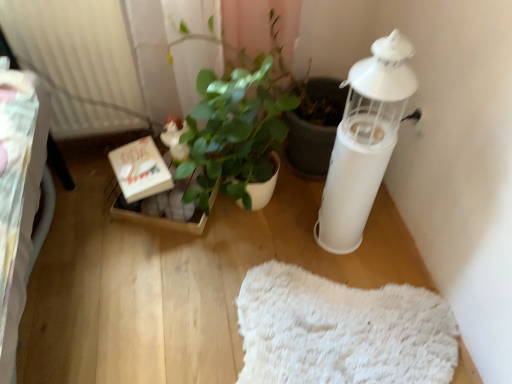
Question: Is white fluffy mat at lower center not near white matte candle holder at right?

Choices:
 (A) yes
 (B) no

Answer: (B)

Question: Could you tell me if white fluffy mat at lower center is turned towards white matte candle holder at right?

Choices:
 (A) yes
 (B) no

Answer: (B)

Question: Is white fluffy mat at lower center positioned beyond the bounds of white matte candle holder at right?

Choices:
 (A) no
 (B) yes

Answer: (B)

Question: Is white fluffy mat at lower center further to camera compared to white matte candle holder at right?

Choices:
 (A) no
 (B) yes

Answer: (B)

Question: Considering the relative sizes of white fluffy mat at lower center and white matte candle holder at right in the image provided, is white fluffy mat at lower center wider than white matte candle holder at right?

Choices:
 (A) no
 (B) yes

Answer: (B)

Question: From the image's perspective, is white ribbed radiator at upper left positioned above or below wooden cardboard box at center, marked as the second cardboard box in a front-to-back arrangement?

Choices:
 (A) above
 (B) below

Answer: (A)

Question: Is white ribbed radiator at upper left bigger or smaller than wooden cardboard box at center, the 1th cardboard box viewed from the back?

Choices:
 (A) small
 (B) big

Answer: (B)

Question: From a real-world perspective, is white ribbed radiator at upper left physically located above or below wooden cardboard box at center, marked as the second cardboard box in a front-to-back arrangement?

Choices:
 (A) below
 (B) above

Answer: (B)

Question: Looking at their shapes, would you say white ribbed radiator at upper left is wider or thinner than wooden cardboard box at center, marked as the second cardboard box in a front-to-back arrangement?

Choices:
 (A) thin
 (B) wide

Answer: (A)

Question: Does point (391, 99) appear closer or farther from the camera than point (382, 317)?

Choices:
 (A) closer
 (B) farther

Answer: (A)

Question: Choose the correct answer: Is white matte candle holder at right inside white fluffy mat at lower center or outside it?

Choices:
 (A) outside
 (B) inside

Answer: (A)

Question: Considering the positions of white matte candle holder at right and white fluffy mat at lower center in the image, is white matte candle holder at right bigger or smaller than white fluffy mat at lower center?

Choices:
 (A) small
 (B) big

Answer: (B)

Question: Would you say white matte candle holder at right is to the left or to the right of white fluffy mat at lower center in the picture?

Choices:
 (A) right
 (B) left

Answer: (A)

Question: In the image, is wooden cardboard box at center, the 1th cardboard box viewed from the back, positioned in front of or behind green glossy plant at center?

Choices:
 (A) behind
 (B) front

Answer: (A)

Question: Considering the positions of wooden cardboard box at center, the 1th cardboard box viewed from the back, and green glossy plant at center in the image, is wooden cardboard box at center, the 1th cardboard box viewed from the back, bigger or smaller than green glossy plant at center?

Choices:
 (A) small
 (B) big

Answer: (A)